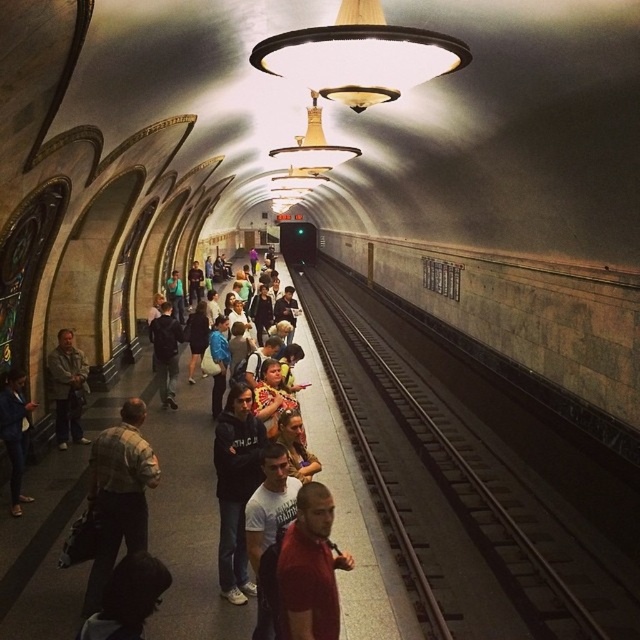
You are a subway worker trying to place a 1.2 meter wide equipment on the platform. You see the black metal train track at center and the black matte jacket at center. Which object can accommodate the equipment width?

The black metal train track at center might be wider than black matte jacket at center, so it can accommodate the equipment width.

Consider the image. You are standing on the subway platform and notice the black metal train track at center and the black matte jacket at center. Which object is nearer to you?

The black metal train track at center is closer to the viewer than the black matte jacket at center.

Consider the image. You are standing on the subway platform and see a person wearing a plaid shirt at center and another wearing a dark gray jacket at left. Which person is nearer to you?

The plaid shirt at center is closer to the viewer than the dark gray jacket at left, so the person in the plaid shirt at center is nearer.